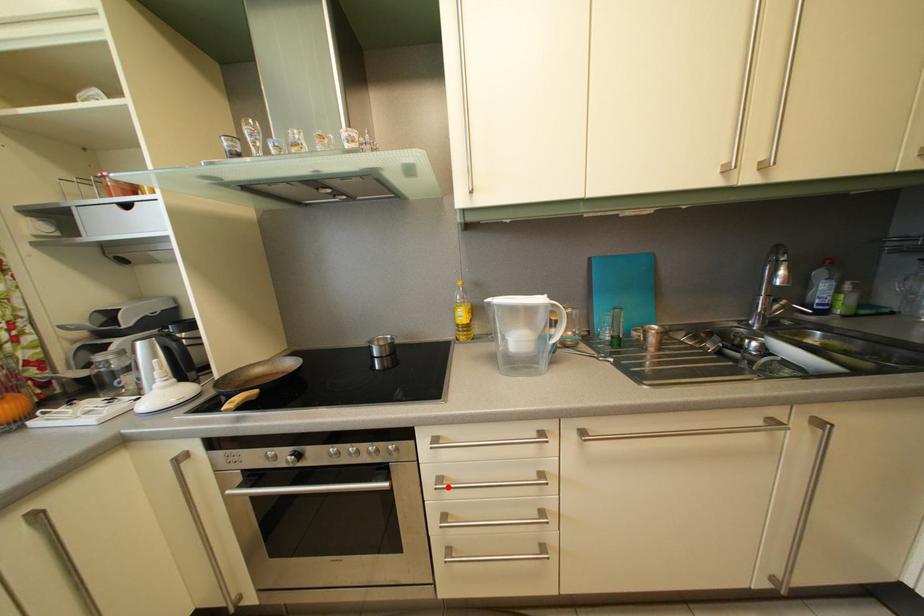
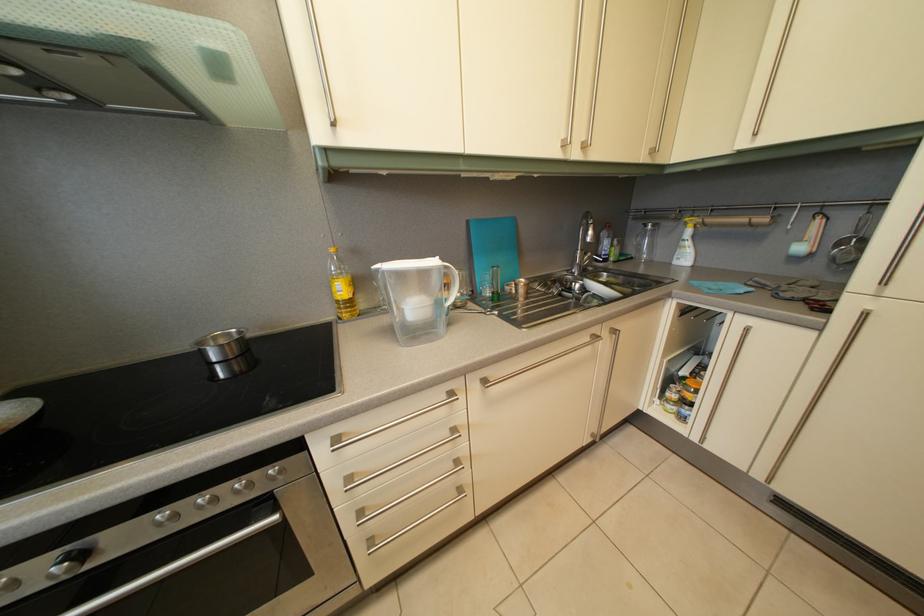
Question: I am providing you with two images of the same scene from different viewpoints. A red point is shown in image1. For the corresponding object point in image2, is it positioned nearer or farther from the camera?

Choices:
 (A) Nearer
 (B) Farther

Answer: (A)